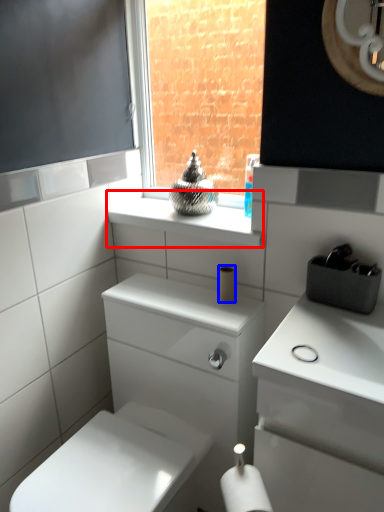
Question: Which object is further to the camera taking this photo, window sill (highlighted by a red box) or toilet paper (highlighted by a blue box)?

Choices:
 (A) window sill
 (B) toilet paper

Answer: (B)